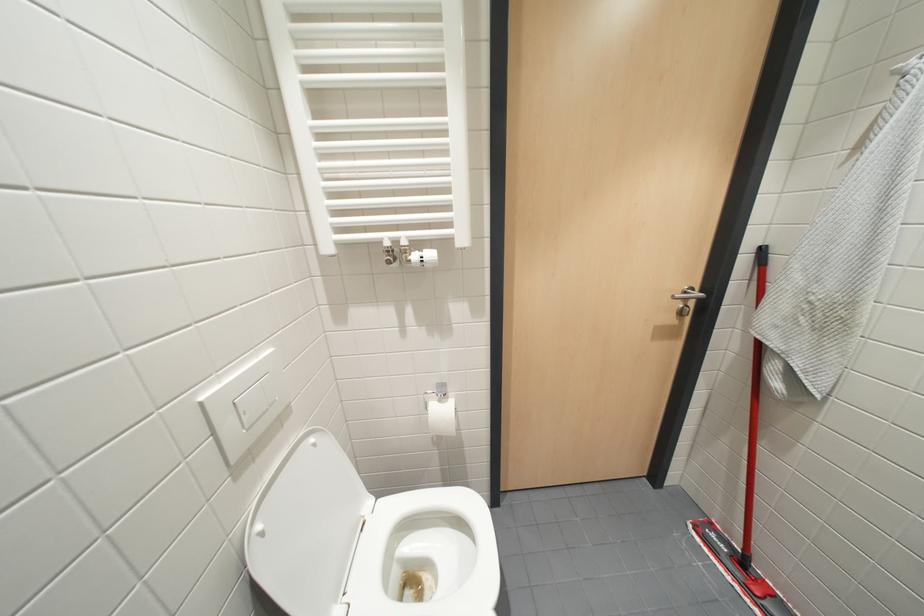
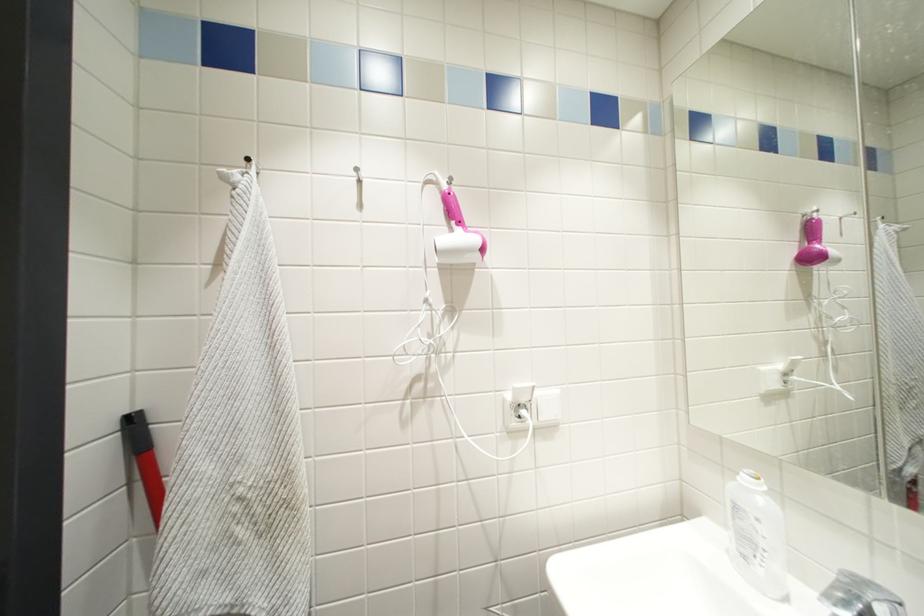
Question: Based on the continuous images, in which direction is the camera rotating? Reply with the corresponding letter.

Choices:
 (A) Left
 (B) Right
 (C) Up
 (D) Down

Answer: (B)